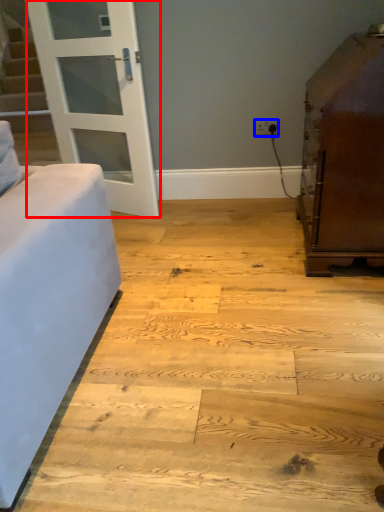
Question: Which object appears farthest to the camera in this image, door (highlighted by a red box) or electric outlet (highlighted by a blue box)?

Choices:
 (A) door
 (B) electric outlet

Answer: (B)